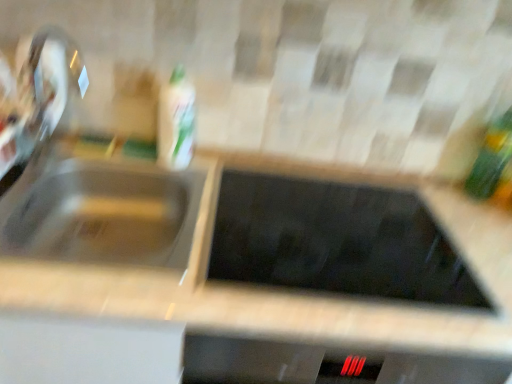
Question: From a real-world perspective, is green glass bottle at right, the 1th bottle viewed from the right, located beneath white glossy bottle at upper center, which is the 1th bottle in left-to-right order?

Choices:
 (A) no
 (B) yes

Answer: (A)

Question: Can you confirm if green glass bottle at right, the 2th bottle positioned from the left, is smaller than white glossy bottle at upper center, marked as the second bottle in a right-to-left arrangement?

Choices:
 (A) no
 (B) yes

Answer: (B)

Question: Considering the relative positions of green glass bottle at right, the 1th bottle viewed from the right, and white glossy bottle at upper center, which is the 1th bottle in left-to-right order, in the image provided, is green glass bottle at right, the 1th bottle viewed from the right, to the right of white glossy bottle at upper center, which is the 1th bottle in left-to-right order, from the viewer's perspective?

Choices:
 (A) yes
 (B) no

Answer: (A)

Question: From a real-world perspective, is green glass bottle at right, the 2th bottle positioned from the left, on white glossy bottle at upper center, which is the 1th bottle in left-to-right order?

Choices:
 (A) yes
 (B) no

Answer: (A)

Question: From the image's perspective, does green glass bottle at right, the 2th bottle positioned from the left, appear higher than white glossy bottle at upper center, which is the 1th bottle in left-to-right order?

Choices:
 (A) no
 (B) yes

Answer: (A)

Question: Considering the positions of point (174, 81) and point (73, 168), is point (174, 81) closer or farther from the camera than point (73, 168)?

Choices:
 (A) closer
 (B) farther

Answer: (A)

Question: In terms of size, does white glossy bottle at upper center, marked as the second bottle in a right-to-left arrangement, appear bigger or smaller than satin silver sink at left?

Choices:
 (A) small
 (B) big

Answer: (A)

Question: Looking at their shapes, would you say white glossy bottle at upper center, marked as the second bottle in a right-to-left arrangement, is wider or thinner than satin silver sink at left?

Choices:
 (A) thin
 (B) wide

Answer: (A)

Question: Choose the correct answer: Is white glossy bottle at upper center, marked as the second bottle in a right-to-left arrangement, inside satin silver sink at left or outside it?

Choices:
 (A) outside
 (B) inside

Answer: (A)

Question: Is green glass bottle at right, the 1th bottle viewed from the right, inside or outside of white glossy bottle at upper center, marked as the second bottle in a right-to-left arrangement?

Choices:
 (A) outside
 (B) inside

Answer: (A)

Question: Is green glass bottle at right, the 2th bottle positioned from the left, bigger or smaller than white glossy bottle at upper center, which is the 1th bottle in left-to-right order?

Choices:
 (A) big
 (B) small

Answer: (B)

Question: Is point (499, 192) positioned closer to the camera than point (167, 105)?

Choices:
 (A) farther
 (B) closer

Answer: (A)

Question: From a real-world perspective, is green glass bottle at right, the 2th bottle positioned from the left, above or below white glossy bottle at upper center, which is the 1th bottle in left-to-right order?

Choices:
 (A) below
 (B) above

Answer: (B)

Question: From a real-world perspective, is satin nickel faucet at left physically located above or below satin silver sink at left?

Choices:
 (A) above
 (B) below

Answer: (A)

Question: From their relative heights in the image, would you say satin nickel faucet at left is taller or shorter than satin silver sink at left?

Choices:
 (A) short
 (B) tall

Answer: (B)